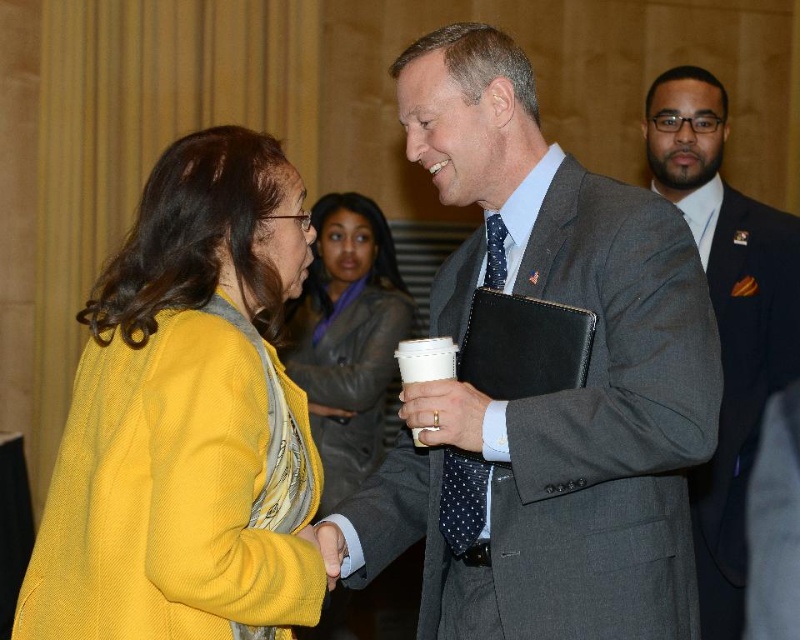
Does polka dot silk tie at center have a greater width compared to matte plastic cup at center?

No, polka dot silk tie at center is not wider than matte plastic cup at center.

Which is in front, point (474, 529) or point (432, 397)?

Point (432, 397) is more forward.

I want to click on polka dot silk tie at center, so click(462, 499).

This screenshot has height=640, width=800. In order to click on yellow corduroy jacket at center in this screenshot , I will do `click(346, 337)`.

Between yellow corduroy jacket at center and matte plastic cup at center, which one has less height?

matte plastic cup at center

Is point (324, 420) farther from viewer compared to point (424, 400)?

Yes, it is.

What are the coordinates of `yellow corduroy jacket at center` in the screenshot? It's located at (346, 337).

Who is positioned more to the right, dark gray suit at right or matte plastic cup at center?

dark gray suit at right

The width and height of the screenshot is (800, 640). I want to click on dark gray suit at right, so click(726, 317).